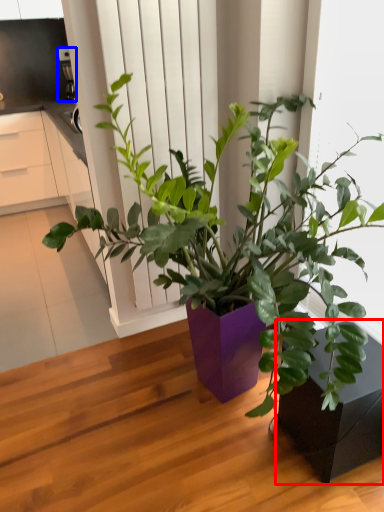
Question: Which object is closer to the camera taking this photo, flowerpot (highlighted by a red box) or appliance (highlighted by a blue box)?

Choices:
 (A) flowerpot
 (B) appliance

Answer: (A)